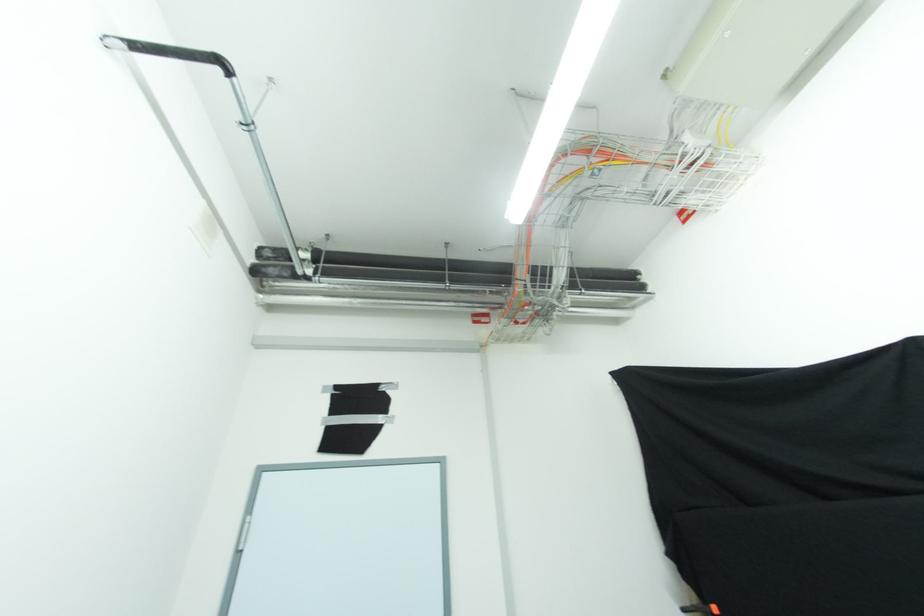
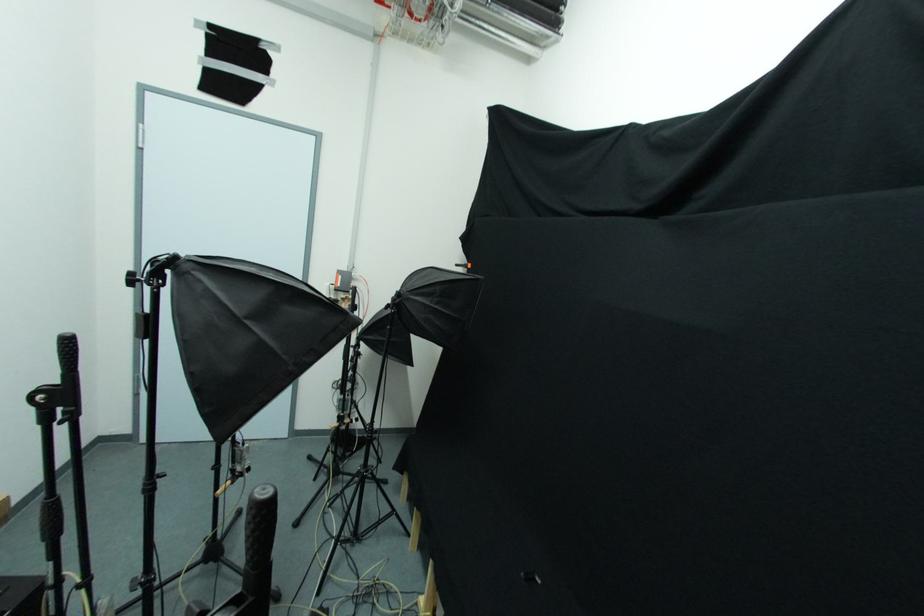
The first image is from the beginning of the video and the second image is from the end. How did the camera likely rotate when shooting the video?

The rotation direction of the camera is right-down.